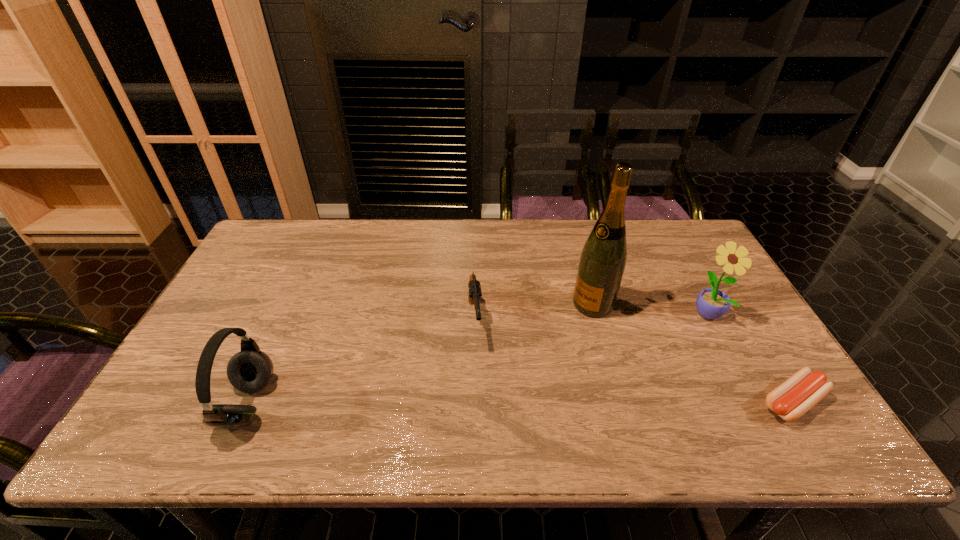
Image resolution: width=960 pixels, height=540 pixels. In order to click on object that is the closest one to the sunflower in this screenshot , I will do `click(803, 390)`.

Where is `the closest object relative to the shortest object`? the closest object relative to the shortest object is located at coordinates (711, 303).

The height and width of the screenshot is (540, 960). I want to click on vacant area in the image that satisfies the following two spatial constraints: 1. on the back side of the tallest object; 2. on the left side of the second shortest object, so (475, 304).

At what (x,y) coordinates should I click in order to perform the action: click on free spot that satisfies the following two spatial constraints: 1. on the back side of the second shortest object; 2. on the left side of the sunflower. Please return your answer as a coordinate pair (x, y). This screenshot has height=540, width=960. Looking at the image, I should click on (475, 313).

At what (x,y) coordinates should I click in order to perform the action: click on free space that satisfies the following two spatial constraints: 1. on the front side of the fourth object from right to left; 2. on the right side of the shortest object. Please return your answer as a coordinate pair (x, y). This screenshot has width=960, height=540. Looking at the image, I should click on tap(473, 402).

Where is `free region that satisfies the following two spatial constraints: 1. on the front side of the fourth tallest object; 2. on the right side of the sausage`? free region that satisfies the following two spatial constraints: 1. on the front side of the fourth tallest object; 2. on the right side of the sausage is located at coordinates (473, 402).

You are a GUI agent. You are given a task and a screenshot of the screen. Output one action in this format:
    pyautogui.click(x=<x>, y=<y>)
    Task: Click on the vacant region that satisfies the following two spatial constraints: 1. on the front side of the tallest object; 2. on the right side of the shortest object
    The height and width of the screenshot is (540, 960).
    Given the screenshot: What is the action you would take?
    pyautogui.click(x=620, y=402)